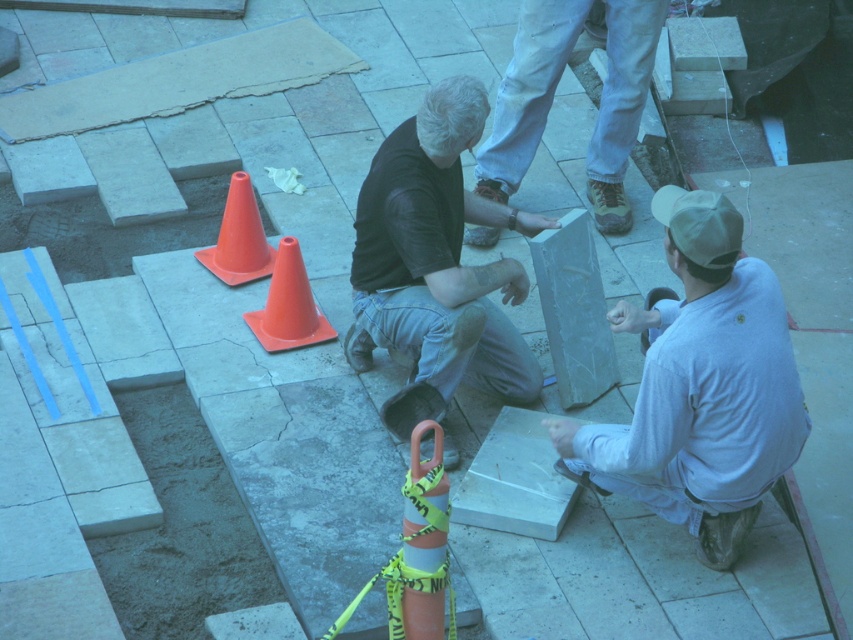
Question: Can you confirm if black matte shirt at center is smaller than orange plastic cone at center-left?

Choices:
 (A) yes
 (B) no

Answer: (B)

Question: Is denim jeans at upper center thinner than orange plastic cone at center-left?

Choices:
 (A) yes
 (B) no

Answer: (B)

Question: Which of the following is the farthest from the observer?

Choices:
 (A) (550, 42)
 (B) (215, 253)
 (C) (317, 332)

Answer: (A)

Question: In this image, where is black matte shirt at center located relative to orange plastic cone at center-left?

Choices:
 (A) right
 (B) left

Answer: (A)

Question: Which object is closer to the camera taking this photo?

Choices:
 (A) orange plastic cone at center
 (B) black matte shirt at center

Answer: (B)

Question: Estimate the real-world distances between objects in this image. Which object is closer to the white marble slab at lower right?

Choices:
 (A) denim jeans at upper center
 (B) black matte shirt at center
 (C) orange plastic cone at center

Answer: (B)